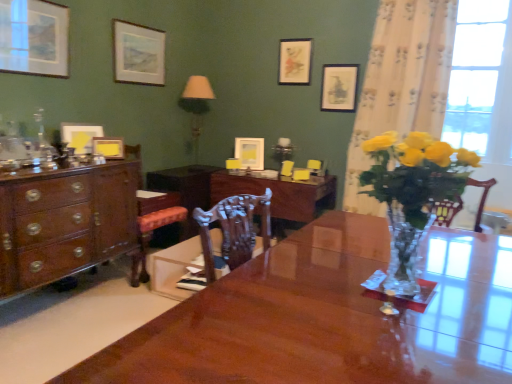
Question: From a real-world perspective, relative to wooden armchair at center, the 1th armchair positioned from the right, is glossy wood desk at center vertically above or below?

Choices:
 (A) below
 (B) above

Answer: (A)

Question: In terms of width, does glossy wood desk at center look wider or thinner when compared to wooden armchair at center, which appears as the 2th armchair when viewed from the left?

Choices:
 (A) thin
 (B) wide

Answer: (B)

Question: Considering the real-world distances, which object is farthest from the translucent glass vase at center?

Choices:
 (A) translucent glass lamp at upper center
 (B) glossy wood desk at center
 (C) matte paper picture frame at upper center, the 2th picture frame viewed from the right
 (D) matte white picture frame at upper left, the 7th picture frame positioned from the right
 (E) wooden table at center

Answer: (A)

Question: Based on their relative distances, which object is farther from the mahogany wood chest of drawers at left?

Choices:
 (A) wooden armchair at center, which appears as the 2th armchair when viewed from the left
 (B) matte white picture frame at upper center, the fourth picture frame viewed from the left
 (C) white floral fabric curtain at right
 (D) matte white picture frame at upper left, the 7th picture frame positioned from the right
 (E) clear glass window at upper right

Answer: (E)